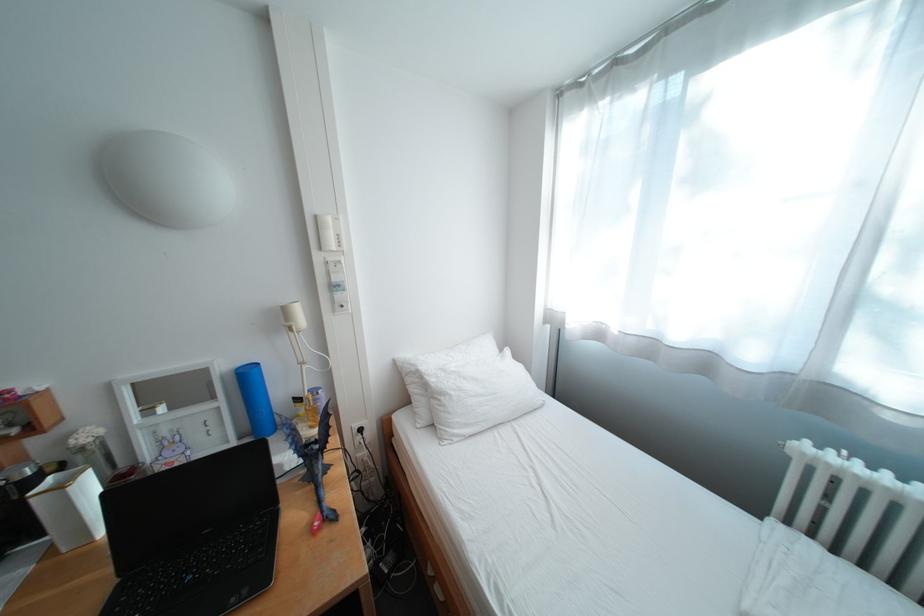
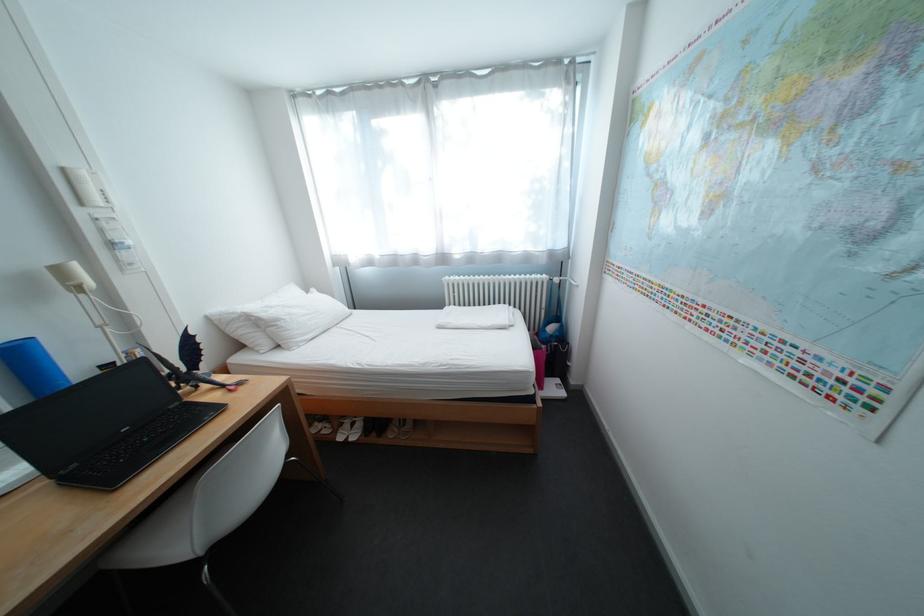
The point at (820, 443) is marked in the first image. Where is the corresponding point in the second image?

(459, 278)